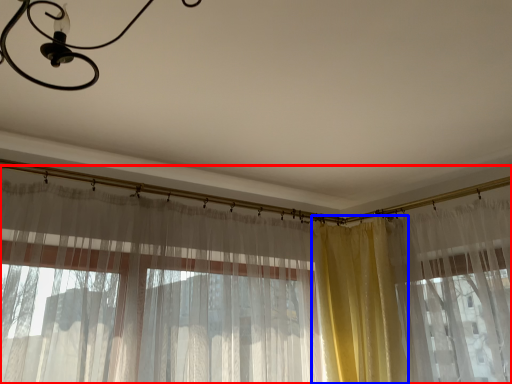
Question: Among these objects, which one is farthest to the camera, curtain (highlighted by a red box) or curtain (highlighted by a blue box)?

Choices:
 (A) curtain
 (B) curtain

Answer: (B)